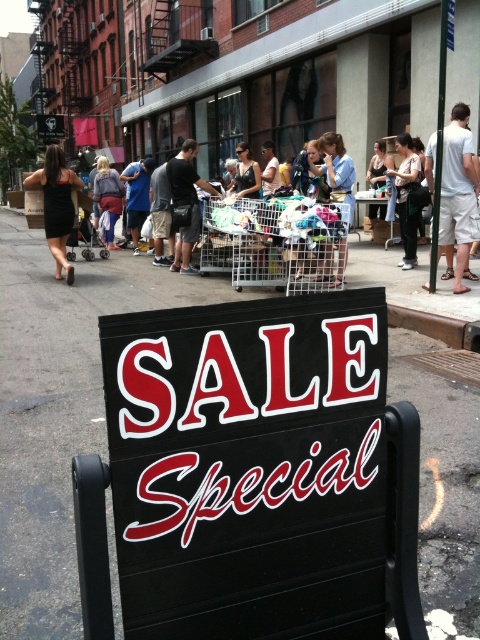
In the scene shown: Can you confirm if black asphalt at center is bigger than light brown leather jacket at center?

Yes.

Consider the image. Does black asphalt at center appear under light brown leather jacket at center?

Correct, black asphalt at center is located below light brown leather jacket at center.

Which is in front, point (104, 275) or point (394, 170)?

Point (104, 275) is more forward.

The width and height of the screenshot is (480, 640). I want to click on black asphalt at center, so click(58, 412).

I want to click on black dress at left, so click(x=57, y=205).

Is black dress at left closer to the viewer compared to light brown leather jacket at center?

Yes, black dress at left is in front of light brown leather jacket at center.

Does point (49, 156) come farther from viewer compared to point (412, 218)?

Yes.

The width and height of the screenshot is (480, 640). What are the coordinates of `black dress at left` in the screenshot? It's located at (57, 205).

Looking at this image, does black asphalt at center have a lesser height compared to denim jacket at center?

No.

Does black asphalt at center appear on the right side of denim jacket at center?

Indeed, black asphalt at center is positioned on the right side of denim jacket at center.

This screenshot has height=640, width=480. I want to click on black asphalt at center, so click(58, 412).